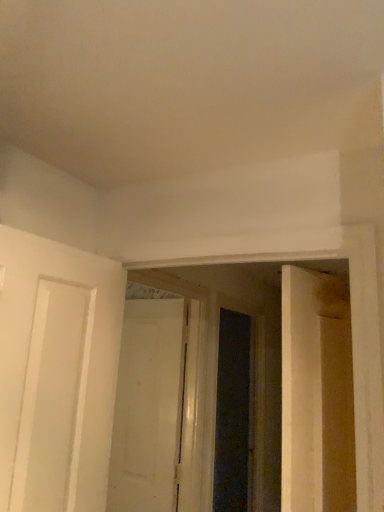
Question: Based on their positions, is white matte door at center located to the left or right of transparent glass screen door at center?

Choices:
 (A) left
 (B) right

Answer: (A)

Question: Choose the correct answer: Is white matte door at center inside transparent glass screen door at center or outside it?

Choices:
 (A) inside
 (B) outside

Answer: (B)

Question: Considering their positions, is white matte door at center located in front of or behind transparent glass screen door at center?

Choices:
 (A) behind
 (B) front

Answer: (B)

Question: From the image's perspective, relative to white matte door at center, is transparent glass screen door at center above or below?

Choices:
 (A) below
 (B) above

Answer: (A)

Question: Looking at their shapes, would you say transparent glass screen door at center is wider or thinner than white matte door at center?

Choices:
 (A) thin
 (B) wide

Answer: (B)

Question: Is point (215, 465) positioned closer to the camera than point (162, 458)?

Choices:
 (A) closer
 (B) farther

Answer: (B)

Question: In terms of height, does transparent glass screen door at center look taller or shorter compared to white matte door at center?

Choices:
 (A) short
 (B) tall

Answer: (B)